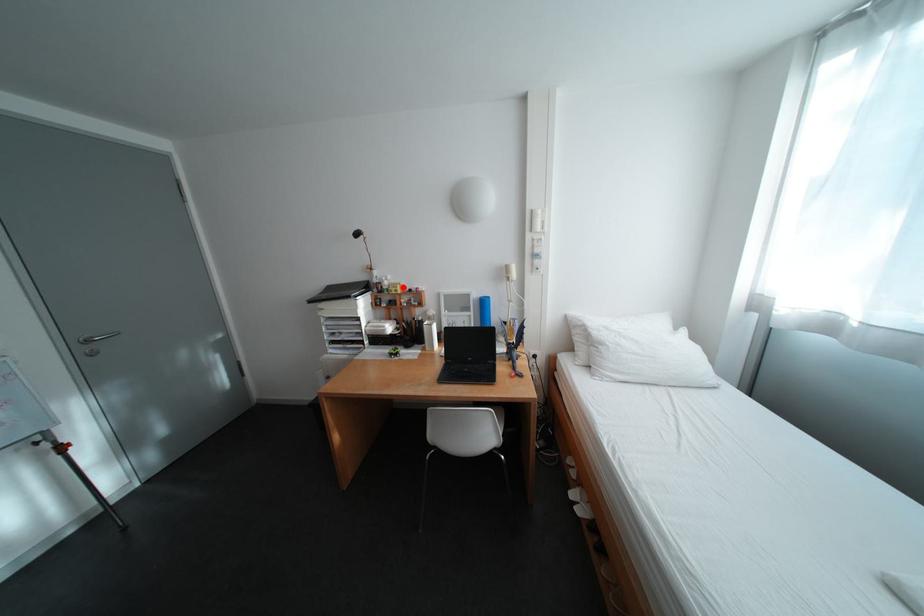
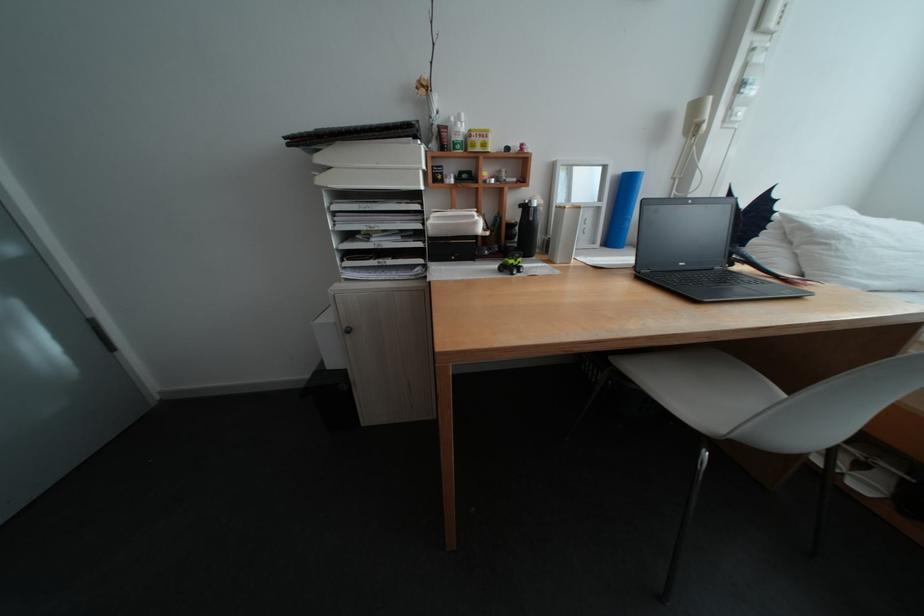
Locate, in the second image, the point that corresponds to the highlighted location in the first image.

(485, 135)